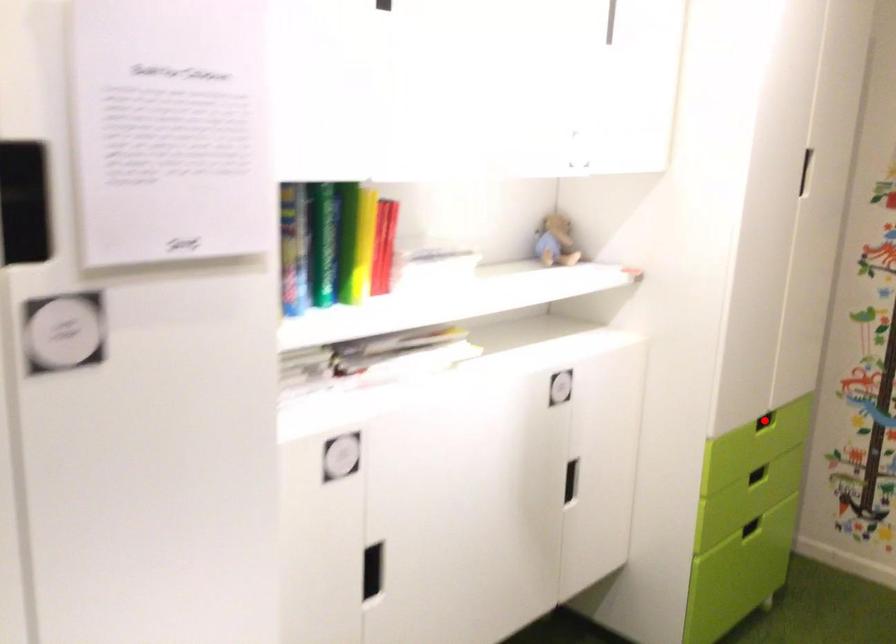
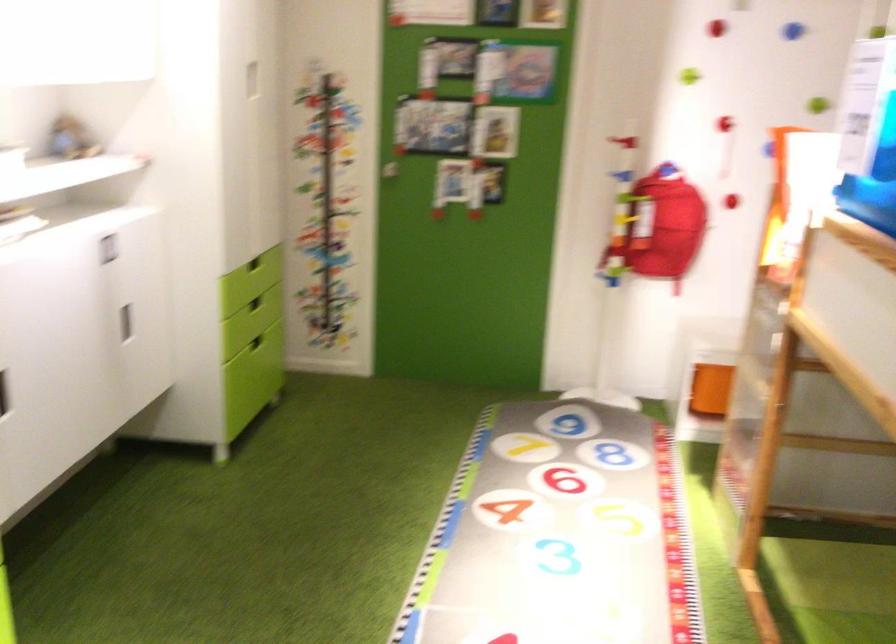
Question: A red point is marked in image1. In image2, is the corresponding 3D point closer to the camera or farther? Reply with the corresponding letter.

Choices:
 (A) The corresponding 3D point is closer.
 (B) The corresponding 3D point is farther.

Answer: (B)